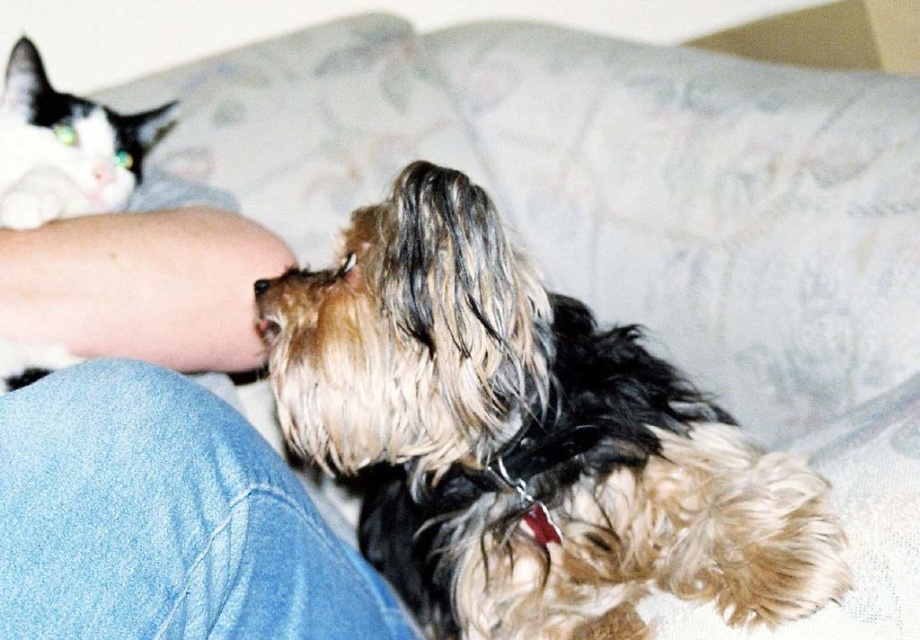
You are taking a photo of two points in the scene. The first point is at coordinates point (x=35, y=83) and the second is at point (x=102, y=177). Which point will appear larger in your photo?

Point (x=35, y=83) will appear larger in the photo because it is closer to the camera than point (x=102, y=177).

You are a pet owner looking at the image of your two pets on the couch. You notice the white fur at upper left and the white glossy cat nose at upper left. Which one is wider?

The white fur at upper left might be wider than the white glossy cat nose at upper left.